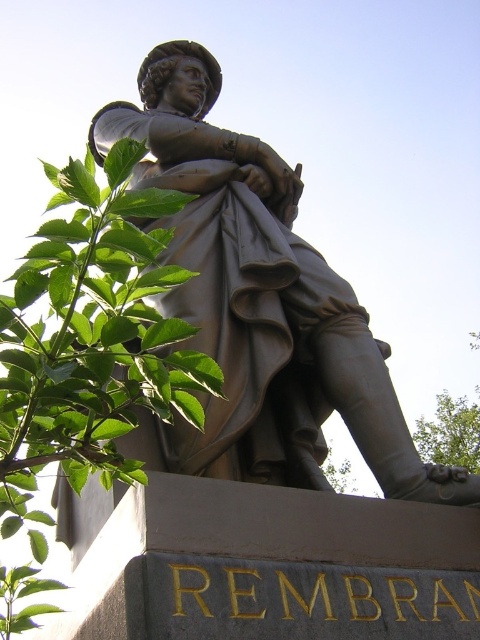
Question: Is bronze statue at center above green leafy plant at upper left?

Choices:
 (A) no
 (B) yes

Answer: (B)

Question: Can you confirm if bronze statue at center is positioned to the right of green leafy plant at lower right?

Choices:
 (A) no
 (B) yes

Answer: (A)

Question: Among these points, which one is nearest to the camera?

Choices:
 (A) (422, 451)
 (B) (29, 259)
 (C) (266, 390)

Answer: (B)

Question: Which object appears farthest from the camera in this image?

Choices:
 (A) bronze statue at center
 (B) green leafy plant at upper left

Answer: (A)

Question: Which point is closer to the camera?

Choices:
 (A) (437, 394)
 (B) (95, 202)

Answer: (B)

Question: Observing the image, what is the correct spatial positioning of green leafy plant at upper left in reference to green leafy plant at lower right?

Choices:
 (A) right
 (B) left

Answer: (B)